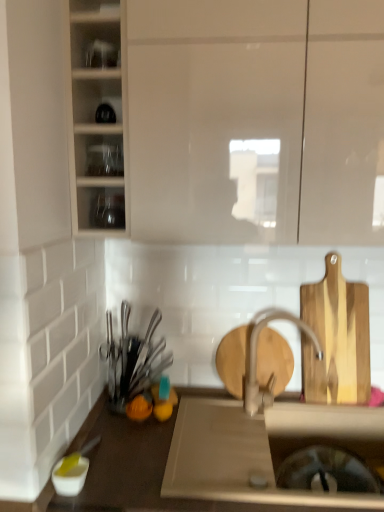
What is the approximate height of matte silver faucet at center?

It is 13.97 inches.

Describe the element at coordinates (241, 119) in the screenshot. I see `matte white cabinet at upper center, which appears as the 2th cabinetry when viewed from the left` at that location.

What do you see at coordinates (96, 44) in the screenshot?
I see `clear glass jars at upper left, which appears as the first shelf when viewed from the top` at bounding box center [96, 44].

The width and height of the screenshot is (384, 512). Describe the element at coordinates (70, 478) in the screenshot. I see `white glossy bowl at lower left, the first tableware in the left-to-right sequence` at that location.

I want to click on transparent glass bottles at upper left, positioned as the 3th shelf in top-to-bottom order, so click(101, 208).

This screenshot has width=384, height=512. Describe the element at coordinates (257, 449) in the screenshot. I see `white matte sink at center` at that location.

The height and width of the screenshot is (512, 384). I want to click on matte silver faucet at center, so click(256, 357).

Can you confirm if wooden cutting board at right is positioned to the left of clear glass shelves at upper left, acting as the second shelf starting from the top?

No, wooden cutting board at right is not to the left of clear glass shelves at upper left, acting as the second shelf starting from the top.

From the image's perspective, count 2nd shelfs upward from the wooden cutting board at right and point to it. Please provide its 2D coordinates.

[(99, 155)]

Based on the photo, which object is further away from the camera, wooden cutting board at right or clear glass shelves at upper left, which appears as the 2th shelf when ordered from the bottom?

wooden cutting board at right is more distant.

Which point is more distant from viewer, (350,373) or (118,170)?

The point (350,373) is farther from the camera.

Where is `tableware that appears on the left of transparent glass bottles at upper left, positioned as the 3th shelf in top-to-bottom order`? tableware that appears on the left of transparent glass bottles at upper left, positioned as the 3th shelf in top-to-bottom order is located at coordinates (70, 478).

Does white glossy bowl at lower left, the first tableware from the bottom, have a greater width compared to transparent glass bottles at upper left, acting as the first shelf starting from the bottom?

Incorrect, the width of white glossy bowl at lower left, the first tableware from the bottom, does not surpass that of transparent glass bottles at upper left, acting as the first shelf starting from the bottom.

Who is shorter, white glossy bowl at lower left, acting as the second tableware starting from the back, or transparent glass bottles at upper left, acting as the first shelf starting from the bottom?

Standing shorter between the two is white glossy bowl at lower left, acting as the second tableware starting from the back.

In the scene shown: What's the angular difference between white glossy bowl at lower left, acting as the second tableware starting from the back, and transparent glass bottles at upper left, positioned as the 3th shelf in top-to-bottom order,'s facing directions?

The angle between the facing direction of white glossy bowl at lower left, acting as the second tableware starting from the back, and the facing direction of transparent glass bottles at upper left, positioned as the 3th shelf in top-to-bottom order, is 0.000391 degrees.

Is brown matte countertop at lower left taller than transparent glass bottles at upper left, acting as the first shelf starting from the bottom?

Yes.

Considering the positions of point (134, 490) and point (104, 226), is point (134, 490) closer or farther from the camera than point (104, 226)?

Point (134, 490) appears to be closer to the viewer than point (104, 226).

Which is more to the left, brown matte countertop at lower left or transparent glass bottles at upper left, positioned as the 3th shelf in top-to-bottom order?

From the viewer's perspective, transparent glass bottles at upper left, positioned as the 3th shelf in top-to-bottom order, appears more on the left side.

Can you confirm if brown matte countertop at lower left is thinner than transparent glass bottles at upper left, acting as the first shelf starting from the bottom?

No, brown matte countertop at lower left is not thinner than transparent glass bottles at upper left, acting as the first shelf starting from the bottom.

In the scene shown: From a real-world perspective, is clear glass shelves at upper left, acting as the second shelf starting from the top, physically located above or below white glossy bowl at lower left, which is the 2th tableware in right-to-left order?

In terms of real-world spatial position, clear glass shelves at upper left, acting as the second shelf starting from the top, is above white glossy bowl at lower left, which is the 2th tableware in right-to-left order.

In the scene shown: From the image's perspective, is clear glass shelves at upper left, which appears as the 2th shelf when ordered from the bottom, above or below white glossy bowl at lower left, arranged as the 2th tableware when viewed from the top?

clear glass shelves at upper left, which appears as the 2th shelf when ordered from the bottom, is above white glossy bowl at lower left, arranged as the 2th tableware when viewed from the top.

Who is taller, clear glass shelves at upper left, acting as the second shelf starting from the top, or white glossy bowl at lower left, which is the 2th tableware in right-to-left order?

clear glass shelves at upper left, acting as the second shelf starting from the top.

Is shiny metallic utensils at left, placed as the second tableware when sorted from front to back, smaller than clear glass jars at upper left, which ranks as the 3th shelf in bottom-to-top order?

Incorrect, shiny metallic utensils at left, placed as the second tableware when sorted from front to back, is not smaller in size than clear glass jars at upper left, which ranks as the 3th shelf in bottom-to-top order.

Considering the positions of objects shiny metallic utensils at left, the 1th tableware viewed from the top, and clear glass jars at upper left, which appears as the first shelf when viewed from the top, in the image provided, who is in front, shiny metallic utensils at left, the 1th tableware viewed from the top, or clear glass jars at upper left, which appears as the first shelf when viewed from the top,?

clear glass jars at upper left, which appears as the first shelf when viewed from the top.

Considering the points (126, 374) and (119, 63), which point is behind, point (126, 374) or point (119, 63)?

The point (126, 374) is farther from the camera.

Are shiny metallic utensils at left, which is the first tableware in back-to-front order, and clear glass jars at upper left, which ranks as the 3th shelf in bottom-to-top order, located far from each other?

Actually, shiny metallic utensils at left, which is the first tableware in back-to-front order, and clear glass jars at upper left, which ranks as the 3th shelf in bottom-to-top order, are a little close together.

Is matte white cabinet at upper center, the 1th cabinetry in the right-to-left sequence, bigger or smaller than brown matte countertop at lower left?

matte white cabinet at upper center, the 1th cabinetry in the right-to-left sequence, is smaller than brown matte countertop at lower left.

At what (x,y) coordinates should I click in order to perform the action: click on the 2nd cabinetry directly above the brown matte countertop at lower left (from a real-world perspective). Please return your answer as a coordinate pair (x, y). This screenshot has height=512, width=384. Looking at the image, I should click on (241, 119).

Looking at this image, from a real-world perspective, relative to brown matte countertop at lower left, is matte white cabinet at upper center, the 1th cabinetry in the right-to-left sequence, vertically above or below?

Clearly, from a real-world perspective, matte white cabinet at upper center, the 1th cabinetry in the right-to-left sequence, is above brown matte countertop at lower left.

Could you tell me if matte silver faucet at center is turned towards white matte sink at center?

No, matte silver faucet at center is not facing towards white matte sink at center.

Does matte silver faucet at center have a greater height compared to white matte sink at center?

Indeed, matte silver faucet at center has a greater height compared to white matte sink at center.

Looking at this image, can we say matte silver faucet at center lies outside white matte sink at center?

Yes.

Which is farther from the camera, (250, 331) or (297, 320)?

The point (297, 320) is farther.

Where is `cutting board that appears below the clear glass shelves at upper left, which appears as the 2th shelf when ordered from the bottom (from a real-world perspective)`? This screenshot has height=512, width=384. cutting board that appears below the clear glass shelves at upper left, which appears as the 2th shelf when ordered from the bottom (from a real-world perspective) is located at coordinates (336, 338).

From the image's perspective, which tableware is the 2nd one below the transparent glass bottles at upper left, positioned as the 3th shelf in top-to-bottom order? Please provide its 2D coordinates.

[(70, 478)]

From the image, which object appears to be farther from shiny metallic utensils at left, the 1th tableware viewed from the top, transparent glass bottles at upper left, positioned as the 3th shelf in top-to-bottom order, or matte white cabinet at upper left, which appears as the second cabinetry when viewed from the right?

The object further to shiny metallic utensils at left, the 1th tableware viewed from the top, is matte white cabinet at upper left, which appears as the second cabinetry when viewed from the right.

Estimate the real-world distances between objects in this image. Which object is closer to brown matte countertop at lower left, matte white cabinet at upper left, positioned as the first cabinetry in left-to-right order, or white glossy bowl at lower left, the first tableware in the left-to-right sequence?

white glossy bowl at lower left, the first tableware in the left-to-right sequence, lies closer to brown matte countertop at lower left than the other object.

Estimate the real-world distances between objects in this image. Which object is closer to white matte sink at center, brown matte countertop at lower left or wooden cutting board at right?

Based on the image, brown matte countertop at lower left appears to be nearer to white matte sink at center.

Based on their spatial positions, is white matte sink at center or matte white cabinet at upper left, which appears as the second cabinetry when viewed from the right, further from brown matte countertop at lower left?

matte white cabinet at upper left, which appears as the second cabinetry when viewed from the right, lies further to brown matte countertop at lower left than the other object.

Estimate the real-world distances between objects in this image. Which object is further from shiny metallic utensils at left, acting as the second tableware starting from the bottom, white matte sink at center or wooden cutting board at right?

wooden cutting board at right lies further to shiny metallic utensils at left, acting as the second tableware starting from the bottom, than the other object.

When comparing their distances from clear glass shelves at upper left, acting as the second shelf starting from the top, does white glossy bowl at lower left, marked as the first tableware in a front-to-back arrangement, or matte white cabinet at upper center, which appears as the 2th cabinetry when viewed from the left, seem closer?

Among the two, matte white cabinet at upper center, which appears as the 2th cabinetry when viewed from the left, is located nearer to clear glass shelves at upper left, acting as the second shelf starting from the top.

When comparing their distances from transparent glass bottles at upper left, positioned as the 3th shelf in top-to-bottom order, does matte silver faucet at center or clear glass jars at upper left, which appears as the first shelf when viewed from the top, seem closer?

clear glass jars at upper left, which appears as the first shelf when viewed from the top, lies closer to transparent glass bottles at upper left, positioned as the 3th shelf in top-to-bottom order, than the other object.

When comparing their distances from matte white cabinet at upper left, positioned as the first cabinetry in left-to-right order, does clear glass shelves at upper left, which appears as the 2th shelf when ordered from the bottom, or clear glass jars at upper left, which appears as the first shelf when viewed from the top, seem further?

clear glass jars at upper left, which appears as the first shelf when viewed from the top, is positioned further to the anchor matte white cabinet at upper left, positioned as the first cabinetry in left-to-right order.

The height and width of the screenshot is (512, 384). Find the location of `shelf between clear glass shelves at upper left, acting as the second shelf starting from the top, and brown matte countertop at lower left, in the vertical direction`. shelf between clear glass shelves at upper left, acting as the second shelf starting from the top, and brown matte countertop at lower left, in the vertical direction is located at coordinates (101, 208).

Locate an element on the screen. Image resolution: width=384 pixels, height=512 pixels. cabinetry between matte white cabinet at upper left, which appears as the second cabinetry when viewed from the right, and matte silver faucet at center, in the vertical direction is located at coordinates (241, 119).

At what (x,y) coordinates should I click in order to perform the action: click on tap between wooden cutting board at right and white matte sink at center in the vertical direction. Please return your answer as a coordinate pair (x, y). Looking at the image, I should click on (256, 357).

At what (x,y) coordinates should I click in order to perform the action: click on sink located between white glossy bowl at lower left, the first tableware in the left-to-right sequence, and wooden cutting board at right in the left-right direction. Please return your answer as a coordinate pair (x, y). The height and width of the screenshot is (512, 384). Looking at the image, I should click on (257, 449).